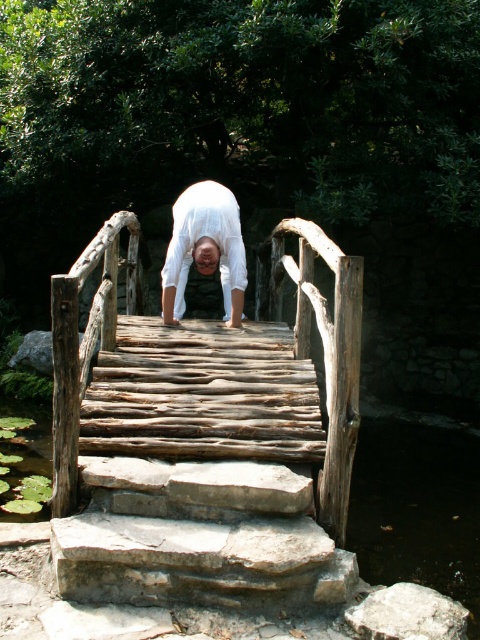
You are standing at the point labeled as point (x=248, y=406) in the image. What object are you standing on?

The point (x=248, y=406) corresponds to the rustic wooden bridge at center, so you are standing on the rustic wooden bridge at center.